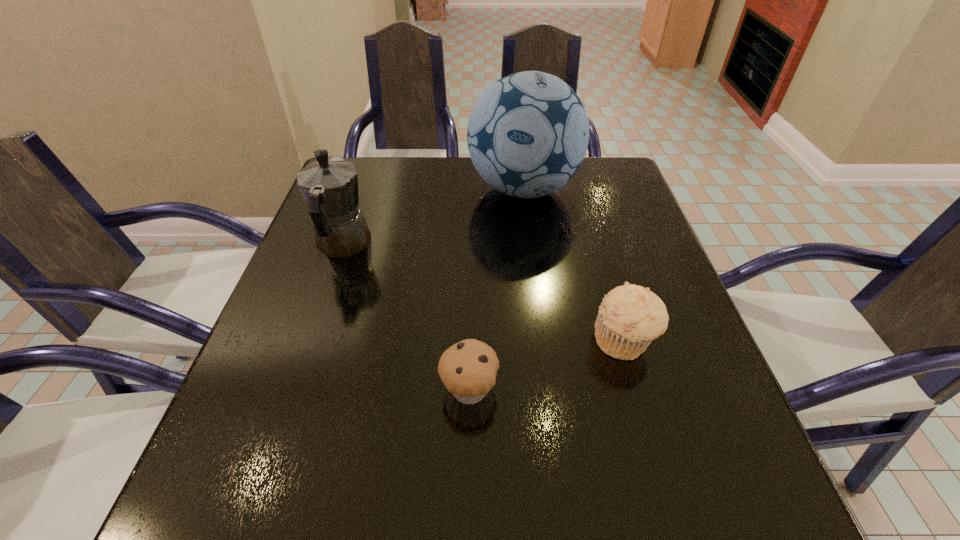
I want to click on vacant area that lies between the third tallest object and the second tallest object, so click(484, 293).

The height and width of the screenshot is (540, 960). I want to click on empty location between the leftmost object and the second shortest object, so click(484, 293).

The width and height of the screenshot is (960, 540). I want to click on free spot between the right muffin and the leftmost object, so click(484, 293).

This screenshot has width=960, height=540. What are the coordinates of `free space between the second tallest object and the soccer ball` in the screenshot? It's located at (433, 217).

Identify which object is located as the third nearest to the soccer ball. Please provide its 2D coordinates. Your answer should be formatted as a tuple, i.e. [(x, y)], where the tuple contains the x and y coordinates of a point satisfying the conditions above.

[(468, 369)]

Where is `object that ranks as the closest to the taller muffin`? The image size is (960, 540). object that ranks as the closest to the taller muffin is located at coordinates (468, 369).

This screenshot has width=960, height=540. I want to click on vacant space that satisfies the following two spatial constraints: 1. on the side with brand of the soccer ball; 2. on the right side of the third tallest object, so click(542, 341).

Locate an element on the screen. blank area in the image that satisfies the following two spatial constraints: 1. on the side with brand of the right muffin; 2. on the right side of the soccer ball is located at coordinates (542, 341).

Find the location of `vacant space that satisfies the following two spatial constraints: 1. on the side with brand of the soccer ball; 2. on the right side of the taller muffin`. vacant space that satisfies the following two spatial constraints: 1. on the side with brand of the soccer ball; 2. on the right side of the taller muffin is located at coordinates coord(542,341).